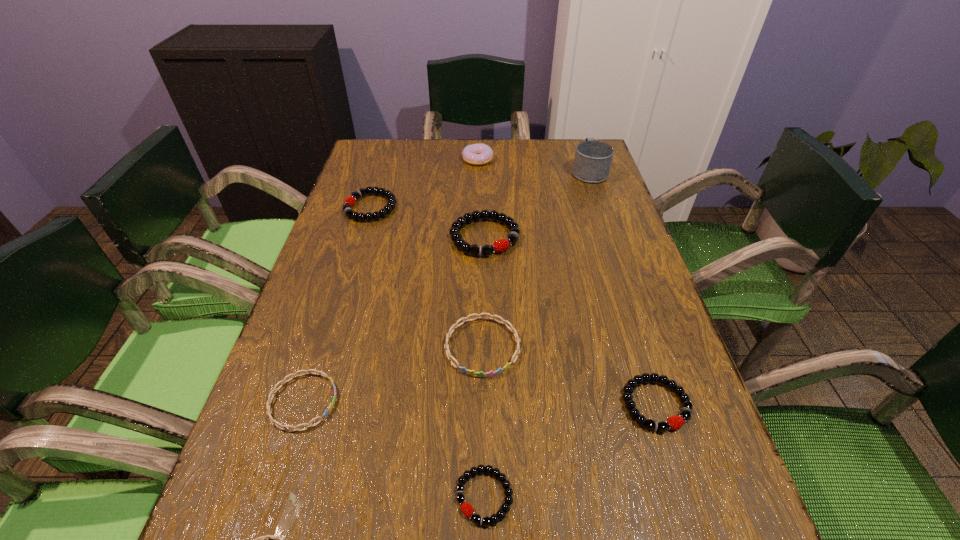
At what (x,y) coordinates should I click in order to perform the action: click on free space between the second tallest object and the second smallest blue bracelet. Please return your answer as a coordinate pair (x, y). Looking at the image, I should click on (391, 280).

Locate an element on the screen. This screenshot has height=540, width=960. blank region between the mug and the eighth shortest object is located at coordinates (534, 165).

Where is `blank region between the leftmost black bracelet and the biggest blue bracelet`? The image size is (960, 540). blank region between the leftmost black bracelet and the biggest blue bracelet is located at coordinates (426, 276).

The width and height of the screenshot is (960, 540). Find the location of `empty location between the rightmost black bracelet and the mug`. empty location between the rightmost black bracelet and the mug is located at coordinates pyautogui.click(x=622, y=288).

Locate an element on the screen. Image resolution: width=960 pixels, height=540 pixels. blank region between the nearest black bracelet and the tallest bracelet is located at coordinates (485, 366).

The width and height of the screenshot is (960, 540). What are the coordinates of `free space between the tallest bracelet and the second smallest blue bracelet` in the screenshot? It's located at (394, 319).

Identify which object is the fourth nearest to the third smallest black bracelet. Please provide its 2D coordinates. Your answer should be formatted as a tuple, i.e. [(x, y)], where the tuple contains the x and y coordinates of a point satisfying the conditions above.

[(282, 427)]

Choose which object is the second nearest neighbor to the tallest object. Please provide its 2D coordinates. Your answer should be formatted as a tuple, i.e. [(x, y)], where the tuple contains the x and y coordinates of a point satisfying the conditions above.

[(501, 245)]

Select which bracelet is the third closest to the leftmost black bracelet. Please provide its 2D coordinates. Your answer should be formatted as a tuple, i.e. [(x, y)], where the tuple contains the x and y coordinates of a point satisfying the conditions above.

[(282, 427)]

Locate an element on the screen. bracelet object that ranks as the fifth closest to the shortest object is located at coordinates (501, 245).